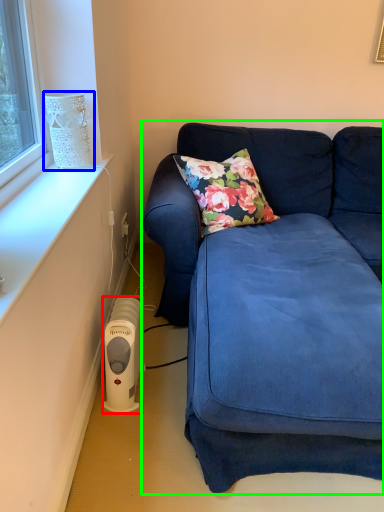
Question: Which is farther away from appliance (highlighted by a red box)? lamp (highlighted by a blue box) or studio couch (highlighted by a green box)?

Choices:
 (A) lamp
 (B) studio couch

Answer: (A)